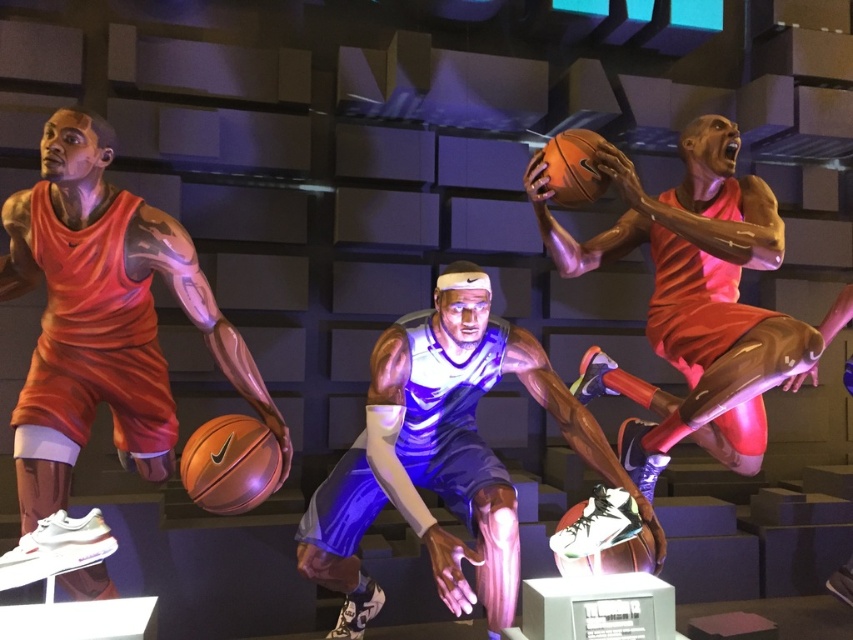
Question: Which of these objects is positioned closest to the shiny orange basketball at center?

Choices:
 (A) orange matte basketball at upper right
 (B) shiny orange basketball player at upper right

Answer: (B)

Question: Can you confirm if matte orange jersey at left is positioned above shiny blue jersey at center?

Choices:
 (A) yes
 (B) no

Answer: (A)

Question: Estimate the real-world distances between objects in this image. Which object is farther from the orange matte basketball at upper right?

Choices:
 (A) matte orange jersey at left
 (B) shiny blue jersey at center

Answer: (A)

Question: Which object appears farthest from the camera in this image?

Choices:
 (A) matte orange jersey at left
 (B) orange matte basketball at center

Answer: (B)

Question: Where is matte orange jersey at left located in relation to shiny blue jersey at center in the image?

Choices:
 (A) above
 (B) below

Answer: (A)

Question: Does matte orange jersey at left have a larger size compared to orange matte basketball at upper right?

Choices:
 (A) yes
 (B) no

Answer: (A)